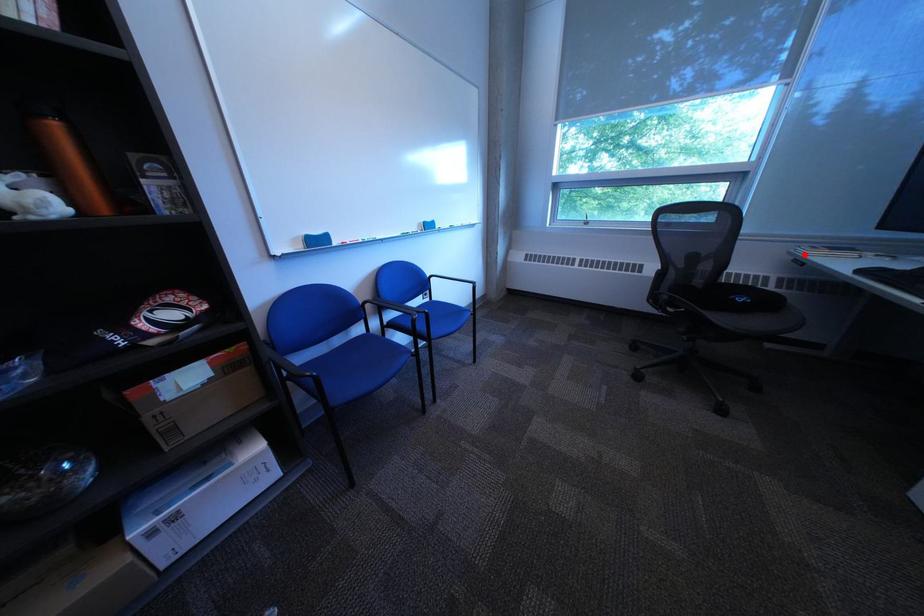
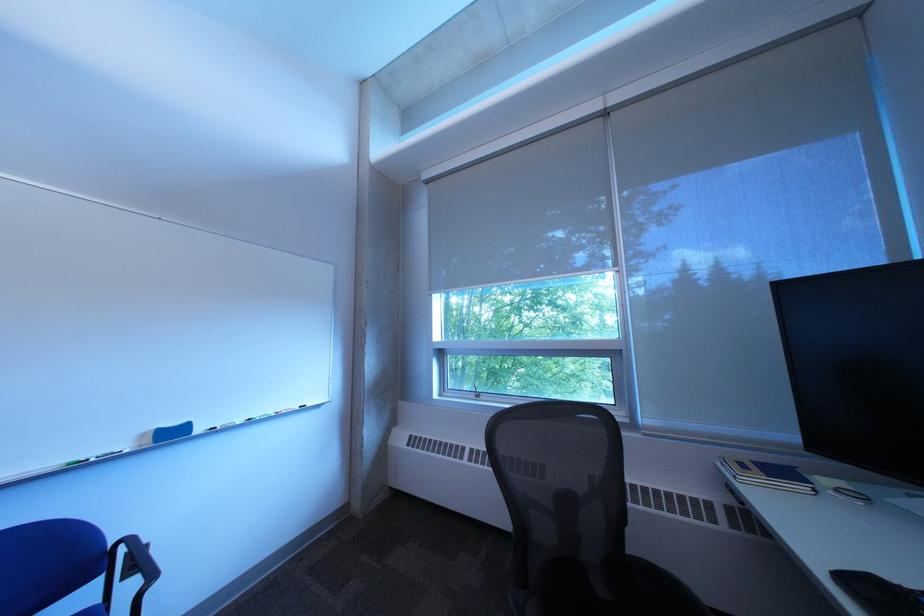
Find the pixel in the second image that matches the highlighted location in the first image.

(733, 468)